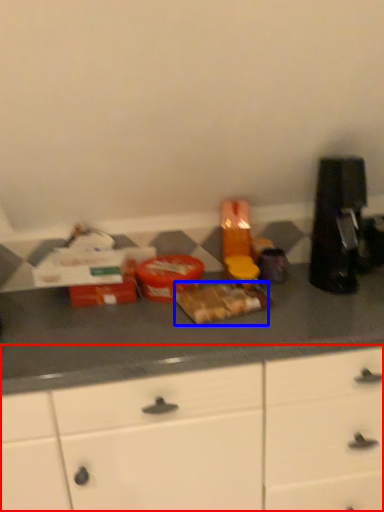
Question: Among these objects, which one is nearest to the camera, cabinetry (highlighted by a red box) or food (highlighted by a blue box)?

Choices:
 (A) cabinetry
 (B) food

Answer: (A)